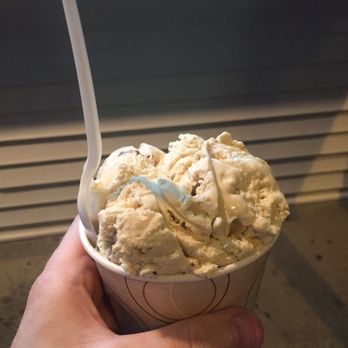
Where is `spoon`? This screenshot has height=348, width=348. spoon is located at coordinates (85, 197).